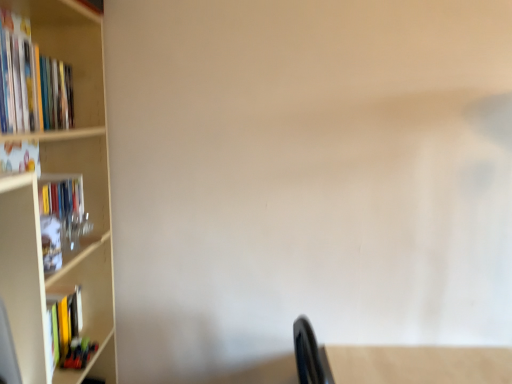
Question: From a real-world perspective, does matte green book at lower left, arranged as the third book when viewed from the top, stand above hardcover book at left, which is the second book from bottom to top?

Choices:
 (A) yes
 (B) no

Answer: (B)

Question: Does matte green book at lower left, the first book when ordered from bottom to top, have a lesser height compared to hardcover book at left, which is the second book from top to bottom?

Choices:
 (A) yes
 (B) no

Answer: (A)

Question: Can you confirm if matte green book at lower left, arranged as the third book when viewed from the top, is positioned to the left of hardcover book at left, which is the second book from top to bottom?

Choices:
 (A) yes
 (B) no

Answer: (B)

Question: Is matte green book at lower left, the first book when ordered from bottom to top, behind hardcover book at left, which is the second book from bottom to top?

Choices:
 (A) yes
 (B) no

Answer: (A)

Question: Is matte green book at lower left, the first book when ordered from bottom to top, thinner than hardcover book at left, which is the second book from top to bottom?

Choices:
 (A) yes
 (B) no

Answer: (B)

Question: Would you say matte green book at lower left, the first book when ordered from bottom to top, is to the left or to the right of white matte bookcase at left in the picture?

Choices:
 (A) right
 (B) left

Answer: (A)

Question: From the image's perspective, is matte green book at lower left, arranged as the third book when viewed from the top, above or below white matte bookcase at left?

Choices:
 (A) above
 (B) below

Answer: (B)

Question: Considering their positions, is matte green book at lower left, the first book when ordered from bottom to top, located in front of or behind white matte bookcase at left?

Choices:
 (A) front
 (B) behind

Answer: (B)

Question: Is matte green book at lower left, arranged as the third book when viewed from the top, taller or shorter than white matte bookcase at left?

Choices:
 (A) tall
 (B) short

Answer: (B)

Question: From their relative heights in the image, would you say hardcover books at left, which is counted as the third book, starting from the bottom, is taller or shorter than hardcover book at left, which is the second book from top to bottom?

Choices:
 (A) short
 (B) tall

Answer: (B)

Question: From the image's perspective, is hardcover books at left, which ranks as the 1th book in top-to-bottom order, positioned above or below hardcover book at left, which is the second book from bottom to top?

Choices:
 (A) below
 (B) above

Answer: (B)

Question: In the image, is hardcover books at left, which is counted as the third book, starting from the bottom, positioned in front of or behind hardcover book at left, which is the second book from bottom to top?

Choices:
 (A) behind
 (B) front

Answer: (B)

Question: Would you say hardcover books at left, which ranks as the 1th book in top-to-bottom order, is inside or outside hardcover book at left, which is the second book from bottom to top?

Choices:
 (A) inside
 (B) outside

Answer: (B)

Question: Is point (110, 266) positioned closer to the camera than point (53, 192)?

Choices:
 (A) farther
 (B) closer

Answer: (A)

Question: In the image, is white matte bookcase at left on the left side or the right side of hardcover book at left, which is the second book from top to bottom?

Choices:
 (A) left
 (B) right

Answer: (B)